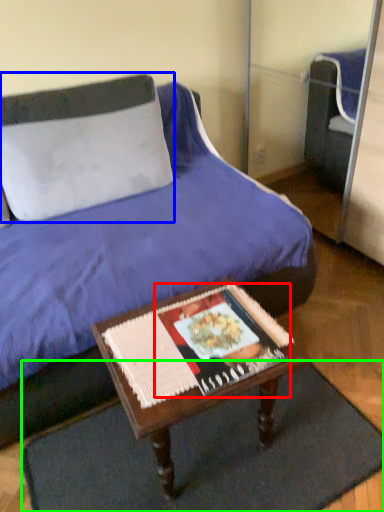
Question: Considering the real-world distances, which object is farthest from magazine (highlighted by a red box)? pillow (highlighted by a blue box) or doormat (highlighted by a green box)?

Choices:
 (A) pillow
 (B) doormat

Answer: (A)